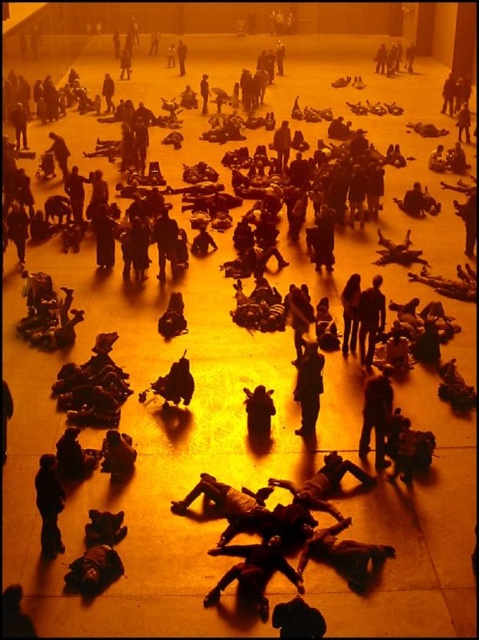
Which is more to the right, dark gray fabric figure at lower left or dark brown leather bag at center?

Positioned to the right is dark brown leather bag at center.

Does dark gray fabric figure at lower left come behind dark brown leather bag at center?

No, it is in front of dark brown leather bag at center.

From the picture: Who is more forward, (40,502) or (250,433)?

Positioned in front is point (40,502).

Where is `dark gray fabric figure at lower left`? The width and height of the screenshot is (479, 640). dark gray fabric figure at lower left is located at coordinates (48, 504).

Who is more forward, (319, 371) or (250, 417)?

Point (319, 371) is in front.

Is point (319, 364) more distant than point (251, 433)?

No, it is in front of (251, 433).

You are a GUI agent. You are given a task and a screenshot of the screen. Output one action in this format:
    pyautogui.click(x=<x>, y=<y>)
    Task: Click on the dark brown leather jacket at center
    This screenshot has height=640, width=479.
    Given the screenshot: What is the action you would take?
    point(308,387)

Can you confirm if dark gray fabric figure at lower left is bigger than dark brown leather jacket at center?

No, dark gray fabric figure at lower left is not bigger than dark brown leather jacket at center.

Who is taller, dark gray fabric figure at lower left or dark brown leather jacket at center?

With more height is dark brown leather jacket at center.

Locate an element on the screen. The height and width of the screenshot is (640, 479). dark gray fabric figure at lower left is located at coordinates (48, 504).